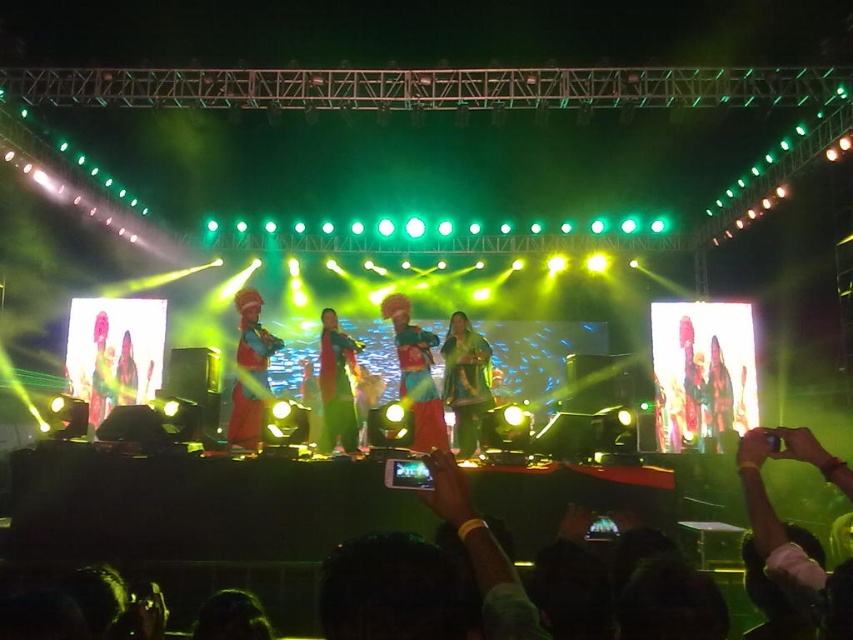
Question: Which point is farther to the camera?

Choices:
 (A) (338, 342)
 (B) (259, 397)
 (C) (416, 330)

Answer: (A)

Question: Can you confirm if dark skin hands at lower center is positioned above green fabric dress at center?

Choices:
 (A) yes
 (B) no

Answer: (B)

Question: Can you confirm if plaid fabric person at center is positioned above multicolored fabric dress at center?

Choices:
 (A) yes
 (B) no

Answer: (B)

Question: Where is green fabric dress at center located in relation to matte green dress at center in the image?

Choices:
 (A) above
 (B) below

Answer: (A)

Question: Which point is farther to the camera?

Choices:
 (A) green fabric dress at center
 (B) matte green dress at center
 (C) shiny green dress at center
 (D) dark skin hands at lower center

Answer: (B)

Question: Which point appears farthest from the camera in this image?

Choices:
 (A) coord(107,364)
 (B) coord(723,433)
 (C) coord(131,403)

Answer: (A)